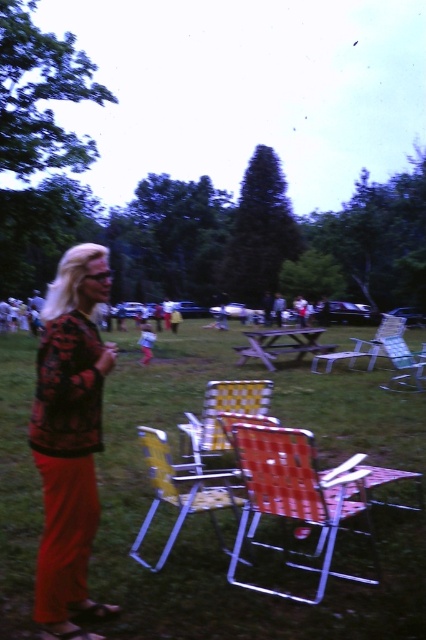
Question: Which point is closer to the camera?

Choices:
 (A) (150, 352)
 (B) (405, 356)
 (C) (249, 474)

Answer: (C)

Question: Which of the following is the closest to the observer?

Choices:
 (A) metallic silver chair at center
 (B) matte black sweater at left

Answer: (B)

Question: Can you confirm if yellow woven fabric beach chair at center is thinner than metallic silver chair at center?

Choices:
 (A) no
 (B) yes

Answer: (B)

Question: From the image, what is the correct spatial relationship of plastic folding chair at center in relation to yellow fabric chair at center?

Choices:
 (A) right
 (B) left

Answer: (A)

Question: Does plastic folding chair at center have a larger size compared to yellow fabric chair at center?

Choices:
 (A) no
 (B) yes

Answer: (B)

Question: Which object is the farthest from the green grass at center?

Choices:
 (A) yellow woven fabric beach chair at center
 (B) matte black sweater at left

Answer: (B)